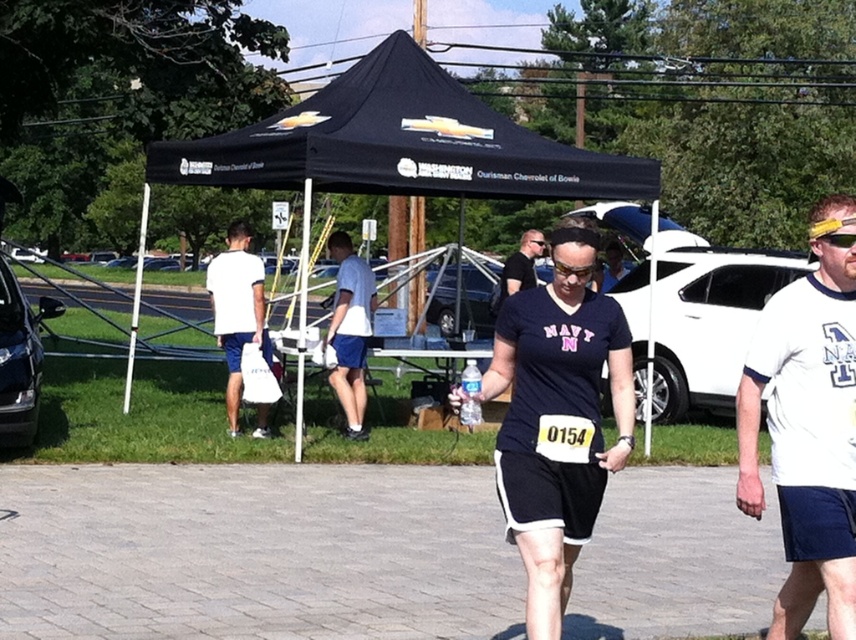
You are organizing a cleanup after the event and need to choose a bag to collect trash. Which bag, the white plastic bag at center or the white fabric bag at center, can hold more items based on their size?

The white plastic bag at center is larger in size than the white fabric bag at center, so it can hold more items.

You are a participant in the race and see both the white plastic bag at center and the white fabric bag at center. Which bag is nearer to you?

The white plastic bag at center is closer to the viewer than the white fabric bag at center.

You are a participant in the race and need to decide whether to walk on the gray concrete pavement at center or under the black fabric canopy at upper center for shade. Which option provides a wider path for walking?

The black fabric canopy at upper center is wider than the gray concrete pavement at center, so walking under the black fabric canopy at upper center would provide a wider path for walking.